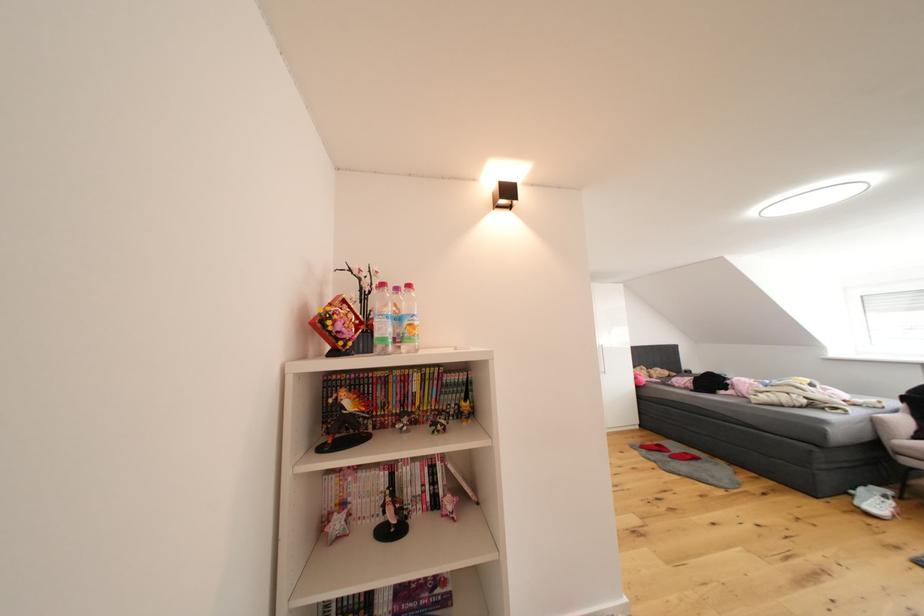
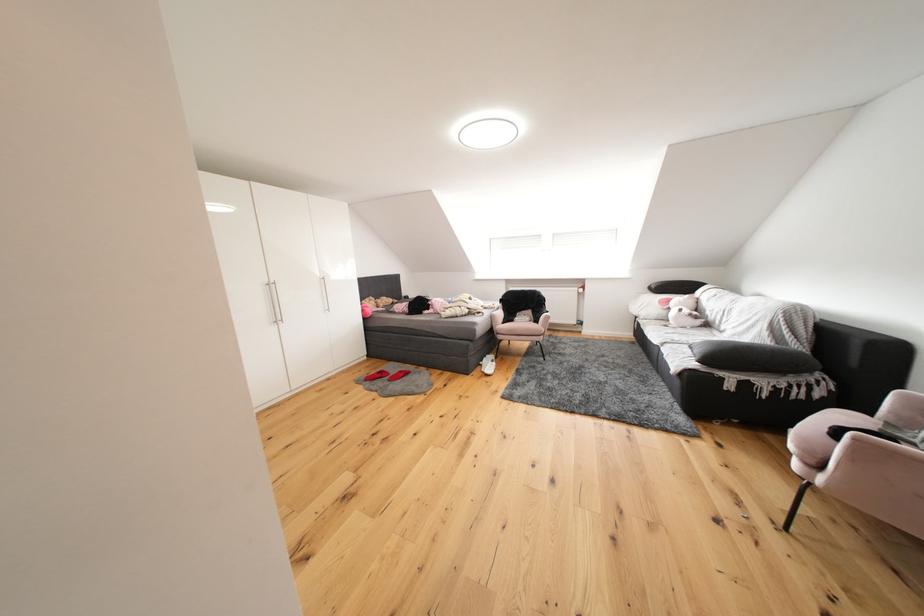
Find the pixel in the second image that matches pixel 683 450 in the first image.

(402, 371)